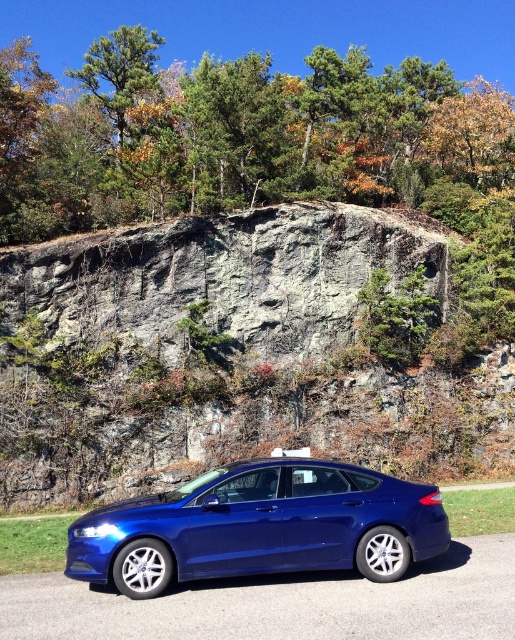
Who is higher up, green leafy tree at upper center or metallic blue car at center?

green leafy tree at upper center

Which is behind, point (42, 220) or point (316, 636)?

The point (42, 220) is more distant.

Between point (96, 147) and point (293, 596), which one is positioned behind?

The point (96, 147) is behind.

Image resolution: width=515 pixels, height=640 pixels. What are the coordinates of `green leafy tree at upper center` in the screenshot? It's located at (236, 134).

Is gray rock at center in front of green leafy tree at upper center?

Yes, gray rock at center is in front of green leafy tree at upper center.

Is gray rock at center wider than green leafy tree at upper center?

In fact, gray rock at center might be narrower than green leafy tree at upper center.

The image size is (515, 640). Describe the element at coordinates (231, 355) in the screenshot. I see `gray rock at center` at that location.

Identify the location of gray rock at center. This screenshot has width=515, height=640. (231, 355).

From the picture: Does gray rock at center lie in front of glossy blue sedan at lower center?

No, gray rock at center is behind glossy blue sedan at lower center.

Where is `gray rock at center`? The image size is (515, 640). gray rock at center is located at coordinates (231, 355).